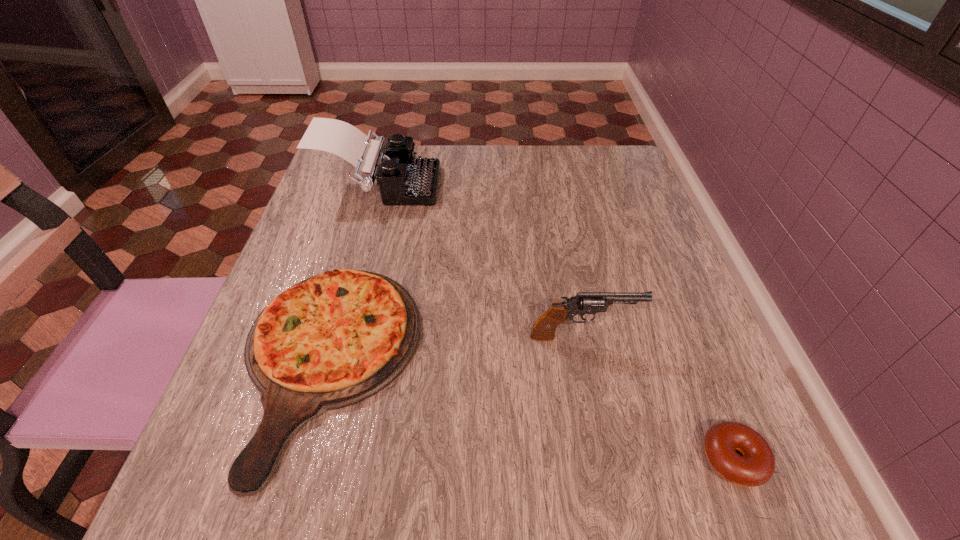
Locate an element on the screen. The height and width of the screenshot is (540, 960). empty space between the pizza and the shortest object is located at coordinates (531, 411).

The width and height of the screenshot is (960, 540). In order to click on vacant region between the second object from right to left and the shortest object in this screenshot , I will do `click(658, 397)`.

Locate an element on the screen. The image size is (960, 540). free point between the gun and the rightmost object is located at coordinates (658, 397).

Locate an element on the screen. The height and width of the screenshot is (540, 960). vacant area that lies between the typewriter and the third object from left to right is located at coordinates (481, 262).

Image resolution: width=960 pixels, height=540 pixels. In order to click on free space between the doughnut and the second tallest object in this screenshot , I will do `click(658, 397)`.

Where is `object that ranks as the third closest to the gun`? object that ranks as the third closest to the gun is located at coordinates (403, 179).

Identify the location of the closest object to the gun. (756, 466).

You are a GUI agent. You are given a task and a screenshot of the screen. Output one action in this format:
    pyautogui.click(x=<x>, y=<y>)
    Task: Click on the free space that satisfies the following two spatial constraints: 1. on the keys of the doughnut; 2. on the right side of the tallest object
    
    Given the screenshot: What is the action you would take?
    pyautogui.click(x=305, y=458)

Identify the location of free space that satisfies the following two spatial constraints: 1. on the keys of the shortest object; 2. on the right side of the typewriter. (305, 458).

You are a GUI agent. You are given a task and a screenshot of the screen. Output one action in this format:
    pyautogui.click(x=<x>, y=<y>)
    Task: Click on the free space that satisfies the following two spatial constraints: 1. along the barrel of the gun; 2. on the front side of the second shortest object
    The width and height of the screenshot is (960, 540).
    Given the screenshot: What is the action you would take?
    point(588,364)